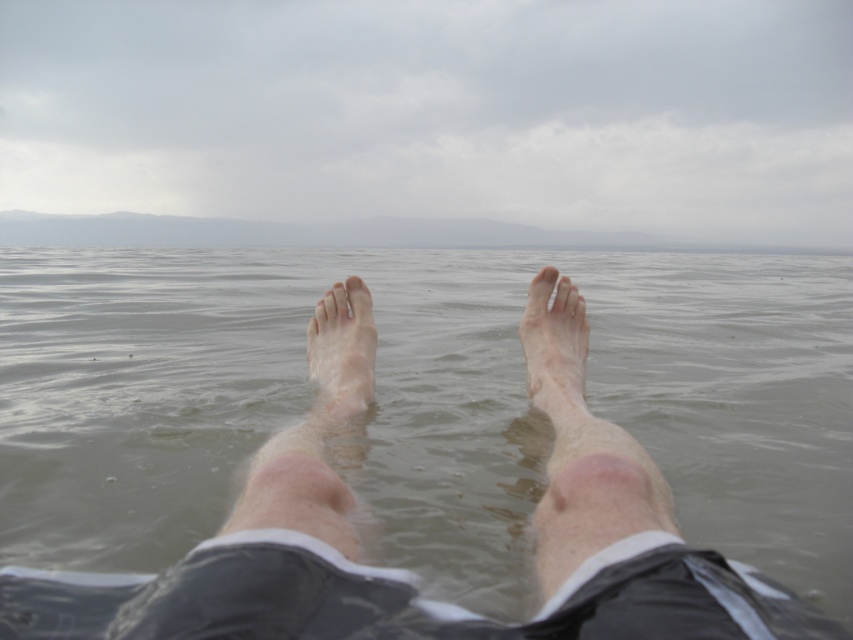
You are standing at the edge of the water and want to step onto the dry sand near the point marked at coordinates point (555, 348). Is the area around this point dry or wet?

The area around point (555, 348) is dry because the dry skin foot at center is located there.

You are standing at the edge of a lake and see your pale skin foot at center and the clear water at feet center. If you want to place a small pebble between them, which object should you place it closer to to ensure it stays dry?

The clear water at feet center is wider than the pale skin foot at center, so placing the pebble closer to the pale skin foot at center would keep it drier as it is narrower and closer to the shore.

You are standing at the edge of the water and see your clear water at feet center and dry skin foot at center. Which object is closer to the horizon?

The clear water at feet center is above the dry skin foot at center, so the dry skin foot at center is closer to the horizon.